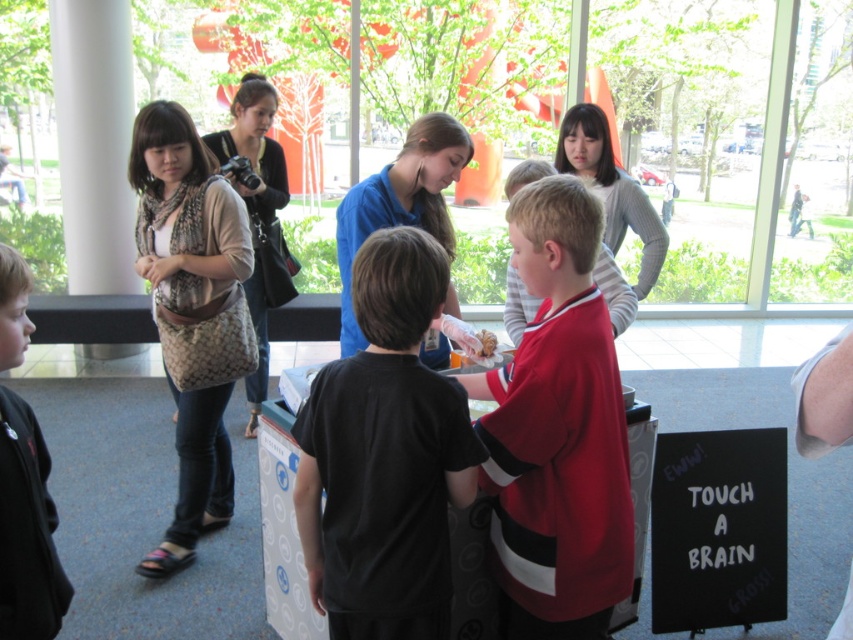
Is black matte shirt at center shorter than leather handbag at upper left?

Indeed, black matte shirt at center has a lesser height compared to leather handbag at upper left.

Is black matte shirt at center smaller than leather handbag at upper left?

Correct, black matte shirt at center occupies less space than leather handbag at upper left.

Describe the element at coordinates (386, 456) in the screenshot. This screenshot has height=640, width=853. I see `black matte shirt at center` at that location.

Identify the location of black matte shirt at center. (386, 456).

Who is lower down, black chalkboard at lower right or leather handbag at upper left?

Positioned lower is black chalkboard at lower right.

Can you confirm if black chalkboard at lower right is positioned above leather handbag at upper left?

No, black chalkboard at lower right is not above leather handbag at upper left.

Is point (730, 445) farther from camera compared to point (265, 301)?

No, it is not.

Identify the location of black chalkboard at lower right. (718, 529).

Does black matte shirt at center have a lesser height compared to black chalkboard at lower right?

Incorrect, black matte shirt at center's height does not fall short of black chalkboard at lower right's.

Who is more distant from viewer, (442,509) or (712,550)?

Point (712,550)

Image resolution: width=853 pixels, height=640 pixels. Describe the element at coordinates (386, 456) in the screenshot. I see `black matte shirt at center` at that location.

You are a GUI agent. You are given a task and a screenshot of the screen. Output one action in this format:
    pyautogui.click(x=<x>, y=<y>)
    Task: Click on the black matte shirt at center
    This screenshot has width=853, height=640.
    Given the screenshot: What is the action you would take?
    pyautogui.click(x=386, y=456)